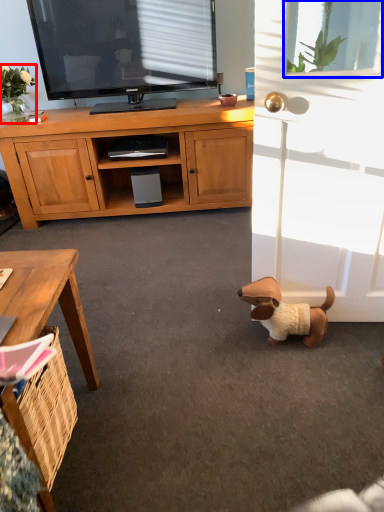
Question: Which of the following is the closest to the observer, flower (highlighted by a red box) or window screen (highlighted by a blue box)?

Choices:
 (A) flower
 (B) window screen

Answer: (B)